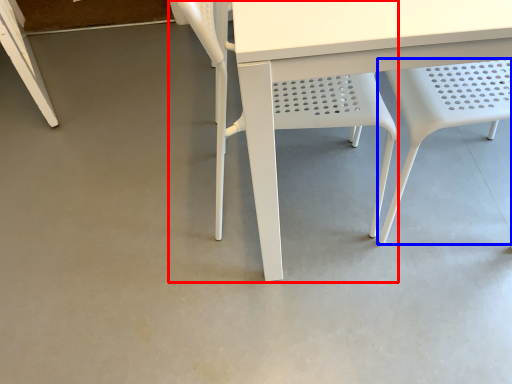
Question: Which of the following is the closest to the observer, chair (highlighted by a red box) or chair (highlighted by a blue box)?

Choices:
 (A) chair
 (B) chair

Answer: (B)